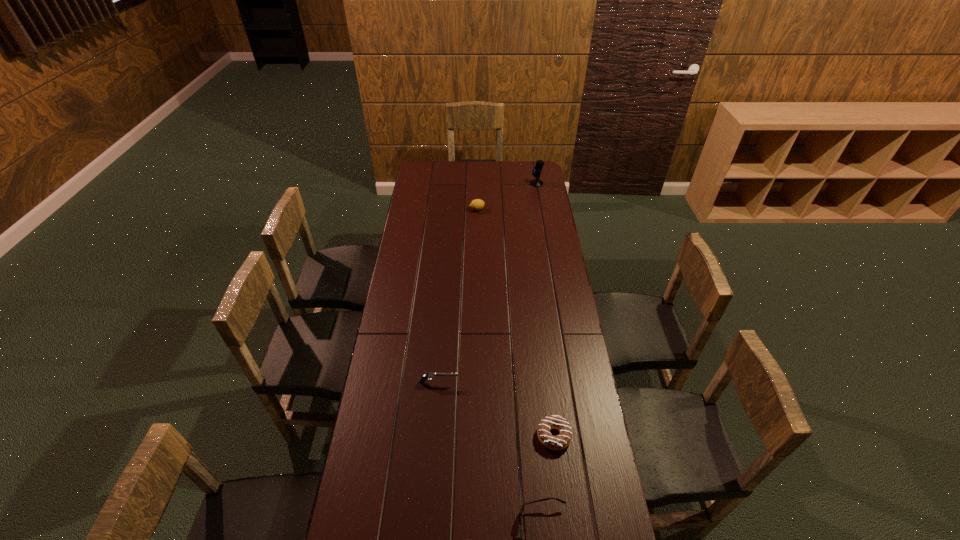
Locate an element on the screen. The width and height of the screenshot is (960, 540). vacant position at the far left corner of the desktop is located at coordinates (415, 176).

Where is `blank space at the far right corner`? The width and height of the screenshot is (960, 540). blank space at the far right corner is located at coordinates (544, 171).

Identify the location of vacant space that is in between the microphone and the leftmost object. Image resolution: width=960 pixels, height=540 pixels. (488, 283).

This screenshot has height=540, width=960. Find the location of `free space between the farthest object and the fourth object from right to left`. free space between the farthest object and the fourth object from right to left is located at coordinates (507, 197).

Image resolution: width=960 pixels, height=540 pixels. In order to click on free space between the microphone and the fourth nearest object in this screenshot , I will do `click(507, 197)`.

At what (x,y) coordinates should I click in order to perform the action: click on free space that is in between the doughnut and the fourth nearest object. Please return your answer as a coordinate pair (x, y). Looking at the image, I should click on (516, 322).

You are a GUI agent. You are given a task and a screenshot of the screen. Output one action in this format:
    pyautogui.click(x=<x>, y=<y>)
    Task: Click on the empty space that is in between the microphone and the fourth farthest object
    The height and width of the screenshot is (540, 960).
    Given the screenshot: What is the action you would take?
    pyautogui.click(x=545, y=309)

The image size is (960, 540). I want to click on the second closest object relative to the tallest object, so click(428, 376).

Select which object appears as the second closest to the nearest object. Please provide its 2D coordinates. Your answer should be formatted as a tuple, i.e. [(x, y)], where the tuple contains the x and y coordinates of a point satisfying the conditions above.

[(428, 376)]

Where is `vacant space that satisfies the following two spatial constraints: 1. on the stand of the farthest object; 2. on the front side of the second nearest object`? Image resolution: width=960 pixels, height=540 pixels. vacant space that satisfies the following two spatial constraints: 1. on the stand of the farthest object; 2. on the front side of the second nearest object is located at coordinates (580, 436).